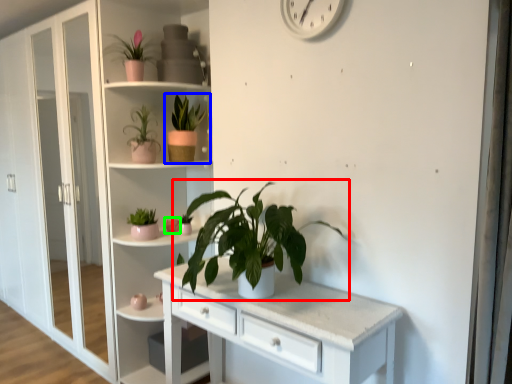
Question: Considering the real-world distances, which object is closest to houseplant (highlighted by a red box)? houseplant (highlighted by a blue box) or flower (highlighted by a green box).

Choices:
 (A) houseplant
 (B) flower

Answer: (B)